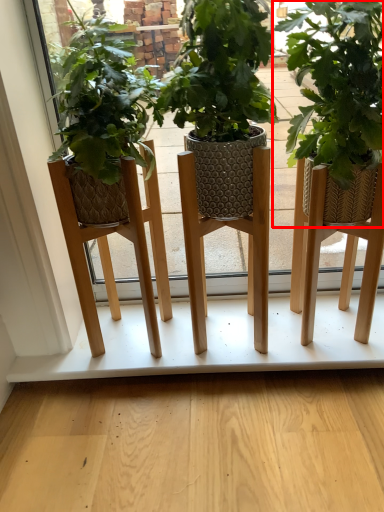
Question: From the image, what is the correct spatial relationship of houseplant (annotated by the red box) in relation to shelf?

Choices:
 (A) right
 (B) left

Answer: (A)